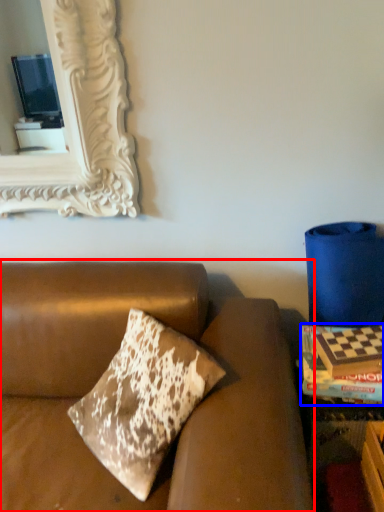
Question: Which object appears closest to the camera in this image, studio couch (highlighted by a red box) or magazine (highlighted by a blue box)?

Choices:
 (A) studio couch
 (B) magazine

Answer: (A)